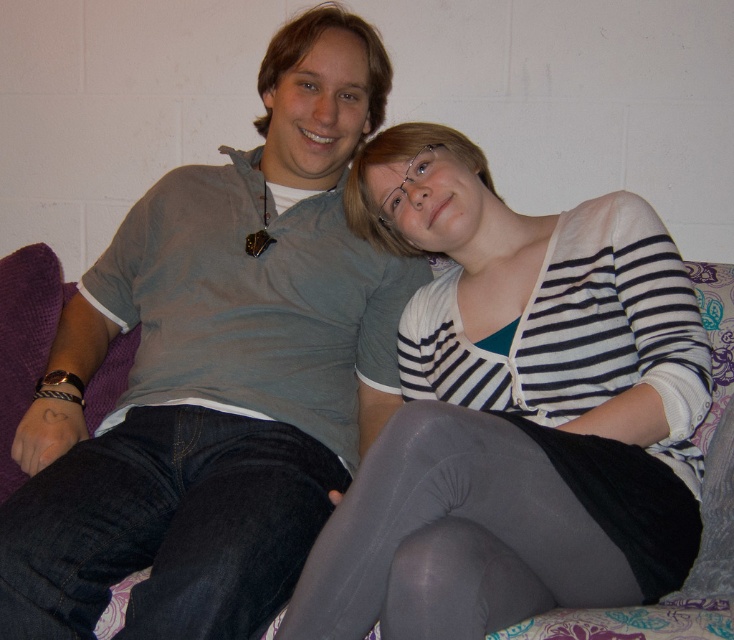
Question: Which of the following is the farthest from the observer?

Choices:
 (A) dark blue denim jeans at lower left
 (B) striped knit cardigan at center

Answer: (A)

Question: Which of the following is the closest to the observer?

Choices:
 (A) (156, 616)
 (B) (501, 570)
 (C) (356, 598)

Answer: (C)

Question: Can you confirm if striped knit cardigan at center is wider than gray tights at lower center?

Choices:
 (A) yes
 (B) no

Answer: (A)

Question: Which point is farther from the camera taking this photo?

Choices:
 (A) (181, 502)
 (B) (677, 403)

Answer: (B)

Question: From the image, what is the correct spatial relationship of striped knit cardigan at center in relation to dark blue denim jeans at lower left?

Choices:
 (A) left
 (B) right

Answer: (B)

Question: Does striped knit cardigan at center appear under gray tights at lower center?

Choices:
 (A) yes
 (B) no

Answer: (B)